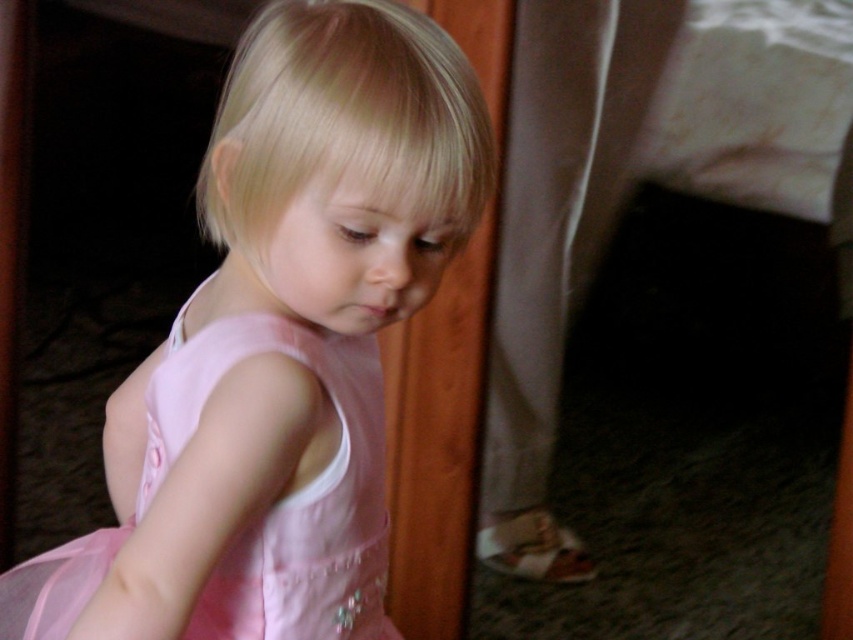
Between pink satin dress at center and pink tulle dress at center, which one is positioned lower?

pink tulle dress at center is below.

I want to click on pink satin dress at center, so point(282,317).